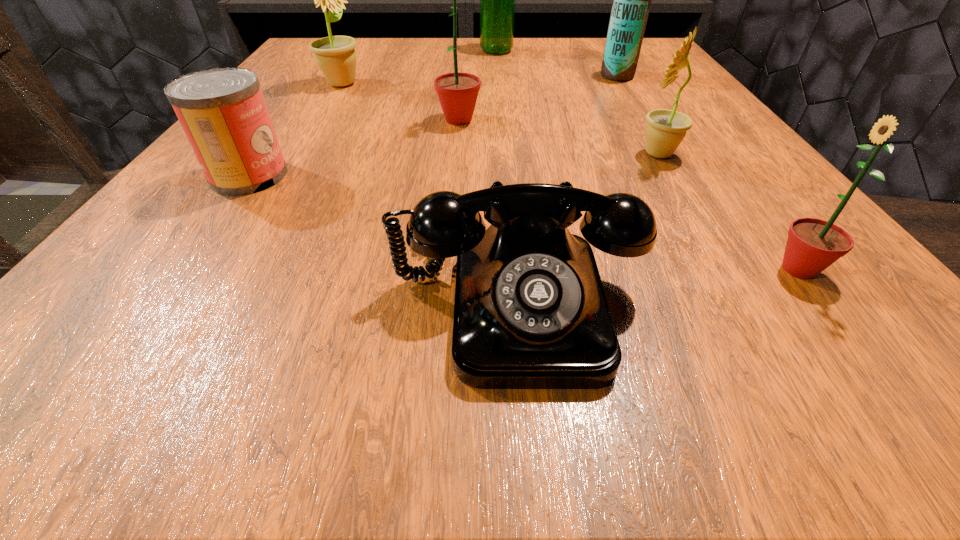
You are a GUI agent. You are given a task and a screenshot of the screen. Output one action in this format:
    pyautogui.click(x=<x>, y=<y>)
    Task: Click on the can positioned at the left edge
    The height and width of the screenshot is (540, 960).
    Given the screenshot: What is the action you would take?
    pyautogui.click(x=222, y=111)

Identify the location of beer bottle located at the right edge. Image resolution: width=960 pixels, height=540 pixels. (632, 0).

I want to click on object present at the far right corner, so click(x=632, y=0).

Identify the location of vacant space at the far edge of the desktop. This screenshot has height=540, width=960. pyautogui.click(x=434, y=52).

Find the location of `free spot at the near edge of the desktop`. free spot at the near edge of the desktop is located at coordinates (366, 360).

Where is `vacant region at the left edge of the desktop`? The image size is (960, 540). vacant region at the left edge of the desktop is located at coordinates (205, 233).

What are the coordinates of `vacant space at the right edge` in the screenshot? It's located at (711, 167).

Where is `vacant region at the near left corner of the desktop`? Image resolution: width=960 pixels, height=540 pixels. vacant region at the near left corner of the desktop is located at coordinates (126, 333).

Identify the location of free space at the far right corner of the desktop. This screenshot has height=540, width=960. (654, 68).

Find the location of `vacant region at the near right corner of the desktop`. vacant region at the near right corner of the desktop is located at coordinates (940, 385).